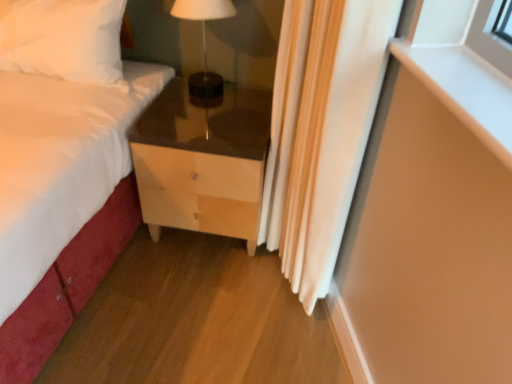
Describe the element at coordinates (203, 161) in the screenshot. I see `matte wood chest of drawers at lower center` at that location.

Find the location of `matte wood chest of drawers at lower center`. matte wood chest of drawers at lower center is located at coordinates (203, 161).

From a real-world perspective, is matte brown table lamp at center located higher than matte wood chest of drawers at lower center?

Yes.

Does matte brown table lamp at center appear on the left side of matte wood chest of drawers at lower center?

Yes, matte brown table lamp at center is to the left of matte wood chest of drawers at lower center.

Do you think matte brown table lamp at center is within matte wood chest of drawers at lower center, or outside of it?

matte brown table lamp at center lies outside matte wood chest of drawers at lower center.

Is matte brown table lamp at center in front of or behind matte wood chest of drawers at lower center in the image?

matte brown table lamp at center is behind matte wood chest of drawers at lower center.

From the image's perspective, who appears lower, white fabric curtain at right or matte wood chest of drawers at lower center?

matte wood chest of drawers at lower center appears lower in the image.

Is white fabric curtain at right aimed at matte wood chest of drawers at lower center?

No, white fabric curtain at right is not facing towards matte wood chest of drawers at lower center.

Looking at their sizes, would you say white fabric curtain at right is wider or thinner than matte wood chest of drawers at lower center?

In the image, white fabric curtain at right appears to be more narrow than matte wood chest of drawers at lower center.

Is white fabric curtain at right positioned beyond the bounds of matte wood chest of drawers at lower center?

That's correct, white fabric curtain at right is outside of matte wood chest of drawers at lower center.

Which is more to the right, matte wood chest of drawers at lower center or white fabric curtain at right?

From the viewer's perspective, white fabric curtain at right appears more on the right side.

Looking at this image, considering their positions, is matte wood chest of drawers at lower center located in front of or behind white fabric curtain at right?

Clearly, matte wood chest of drawers at lower center is behind white fabric curtain at right.

Does matte wood chest of drawers at lower center have a lesser width compared to white fabric curtain at right?

In fact, matte wood chest of drawers at lower center might be wider than white fabric curtain at right.

Measure the distance between matte brown table lamp at center and white fabric curtain at right.

A distance of 22.30 inches exists between matte brown table lamp at center and white fabric curtain at right.

Is matte brown table lamp at center turned away from white fabric curtain at right?

matte brown table lamp at center does not have its back to white fabric curtain at right.

Between matte brown table lamp at center and white fabric curtain at right, which one has smaller width?

Thinner between the two is matte brown table lamp at center.

Which object is more forward, matte brown table lamp at center or white fabric curtain at right?

white fabric curtain at right is in front.

Who is taller, matte wood chest of drawers at lower center or matte brown table lamp at center?

Standing taller between the two is matte wood chest of drawers at lower center.

Identify the location of table lamp lying behind the matte wood chest of drawers at lower center. This screenshot has width=512, height=384. (204, 42).

From the image's perspective, would you say matte wood chest of drawers at lower center is shown under matte brown table lamp at center?

Indeed, from the image's perspective, matte wood chest of drawers at lower center is shown beneath matte brown table lamp at center.

Is matte wood chest of drawers at lower center closer to the viewer compared to matte brown table lamp at center?

→ Yes, matte wood chest of drawers at lower center is closer to the camera.

Can you confirm if white fabric curtain at right is positioned to the left of matte brown table lamp at center?

No.

Can you confirm if white fabric curtain at right is shorter than matte brown table lamp at center?

No.

Looking at their sizes, would you say white fabric curtain at right is wider or thinner than matte brown table lamp at center?

Clearly, white fabric curtain at right has more width compared to matte brown table lamp at center.

Which point is more distant from viewer, (x=313, y=244) or (x=194, y=6)?

Positioned behind is point (x=194, y=6).

The height and width of the screenshot is (384, 512). I want to click on table lamp that is above the matte wood chest of drawers at lower center (from the image's perspective), so click(204, 42).

You are a GUI agent. You are given a task and a screenshot of the screen. Output one action in this format:
    pyautogui.click(x=<x>, y=<y>)
    Task: Click on the chest of drawers behind the white fabric curtain at right
    Image resolution: width=512 pixels, height=384 pixels.
    Given the screenshot: What is the action you would take?
    pyautogui.click(x=203, y=161)

Based on their spatial positions, is matte wood chest of drawers at lower center or matte brown table lamp at center closer to white fabric curtain at right?

matte wood chest of drawers at lower center lies closer to white fabric curtain at right than the other object.

Looking at the image, which one is located closer to matte brown table lamp at center, white fabric curtain at right or matte wood chest of drawers at lower center?

The object closer to matte brown table lamp at center is matte wood chest of drawers at lower center.

In the scene shown: Looking at the image, which one is located further to matte wood chest of drawers at lower center, white fabric curtain at right or matte brown table lamp at center?

matte brown table lamp at center.

Looking at this image, based on their spatial positions, is matte brown table lamp at center or matte wood chest of drawers at lower center further from white fabric curtain at right?

matte brown table lamp at center lies further to white fabric curtain at right than the other object.

From the image, which object appears to be nearer to matte wood chest of drawers at lower center, matte brown table lamp at center or white fabric curtain at right?

white fabric curtain at right.

From the picture: Which object lies further to the anchor point matte brown table lamp at center, matte wood chest of drawers at lower center or white fabric curtain at right?

Based on the image, white fabric curtain at right appears to be further to matte brown table lamp at center.

The height and width of the screenshot is (384, 512). Identify the location of chest of drawers between white fabric curtain at right and matte brown table lamp at center from front to back. (203, 161).